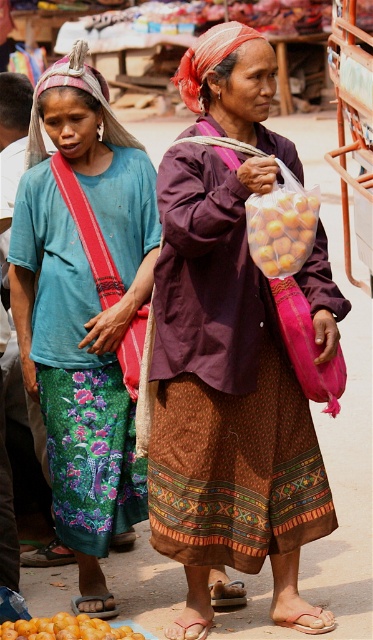
Consider the image. Can you confirm if yellow matte dried fruit at center is positioned below orange matte fruit at lower left?

No, yellow matte dried fruit at center is not below orange matte fruit at lower left.

Is the position of yellow matte dried fruit at center more distant than that of orange matte fruit at lower left?

No, it is not.

Is point (265, 268) positioned in front of point (73, 637)?

Yes, point (265, 268) is in front of point (73, 637).

Find the location of a particular element. yellow matte dried fruit at center is located at coordinates (281, 227).

Is matte purple blouse at center above matte blue shirt at center?

No.

Is matte purple blouse at center below matte blue shirt at center?

Correct, matte purple blouse at center is located below matte blue shirt at center.

Is point (264, 180) positioned behind point (45, 161)?

No, it is in front of (45, 161).

This screenshot has height=640, width=373. Find the location of `matte purple blouse at center`. matte purple blouse at center is located at coordinates (234, 344).

Does matte purple blouse at center appear on the right side of orange matte fruit at lower left?

Indeed, matte purple blouse at center is positioned on the right side of orange matte fruit at lower left.

Is matte purple blouse at center positioned in front of orange matte fruit at lower left?

Yes, it is in front of orange matte fruit at lower left.

Is point (237, 552) positioned before point (46, 618)?

Yes, point (237, 552) is in front of point (46, 618).

The image size is (373, 640). I want to click on matte purple blouse at center, so click(x=234, y=344).